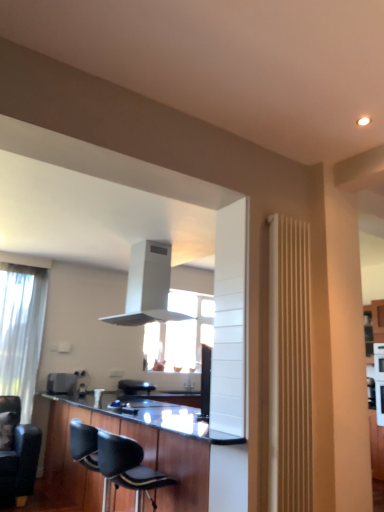
Question: From a real-world perspective, is white matte exhaust hood at upper center beneath black wood cabinetry at lower center?

Choices:
 (A) no
 (B) yes

Answer: (A)

Question: Is white matte exhaust hood at upper center aimed at black wood cabinetry at lower center?

Choices:
 (A) yes
 (B) no

Answer: (B)

Question: Is white matte exhaust hood at upper center in front of black wood cabinetry at lower center?

Choices:
 (A) yes
 (B) no

Answer: (B)

Question: From the image's perspective, is white matte exhaust hood at upper center above black wood cabinetry at lower center?

Choices:
 (A) no
 (B) yes

Answer: (B)

Question: Considering the relative sizes of white matte exhaust hood at upper center and black wood cabinetry at lower center in the image provided, is white matte exhaust hood at upper center taller than black wood cabinetry at lower center?

Choices:
 (A) no
 (B) yes

Answer: (A)

Question: Is black leather armchair at center situated inside black leather chair at lower left, the 1th chair from the left, or outside?

Choices:
 (A) outside
 (B) inside

Answer: (A)

Question: From a real-world perspective, is black leather armchair at center physically located above or below black leather chair at lower left, which is counted as the 2th chair, starting from the front?

Choices:
 (A) above
 (B) below

Answer: (A)

Question: Considering the positions of black leather armchair at center and black leather chair at lower left, which is counted as the 2th chair, starting from the front, in the image, is black leather armchair at center bigger or smaller than black leather chair at lower left, which is counted as the 2th chair, starting from the front,?

Choices:
 (A) big
 (B) small

Answer: (B)

Question: Would you say black leather armchair at center is to the left or to the right of black leather chair at lower left, the first chair positioned from the back, in the picture?

Choices:
 (A) right
 (B) left

Answer: (A)

Question: Considering the positions of point (54, 413) and point (18, 358), is point (54, 413) closer or farther from the camera than point (18, 358)?

Choices:
 (A) farther
 (B) closer

Answer: (B)

Question: Is black wood cabinetry at lower center inside the boundaries of white sheer curtain at left, or outside?

Choices:
 (A) outside
 (B) inside

Answer: (A)

Question: From a real-world perspective, is black wood cabinetry at lower center positioned above or below white sheer curtain at left?

Choices:
 (A) below
 (B) above

Answer: (A)

Question: From the image's perspective, is black wood cabinetry at lower center positioned above or below white sheer curtain at left?

Choices:
 (A) above
 (B) below

Answer: (B)

Question: Considering their positions, is white matte exhaust hood at upper center located in front of or behind black leather armchair at center?

Choices:
 (A) behind
 (B) front

Answer: (B)

Question: In terms of size, does white matte exhaust hood at upper center appear bigger or smaller than black leather armchair at center?

Choices:
 (A) small
 (B) big

Answer: (B)